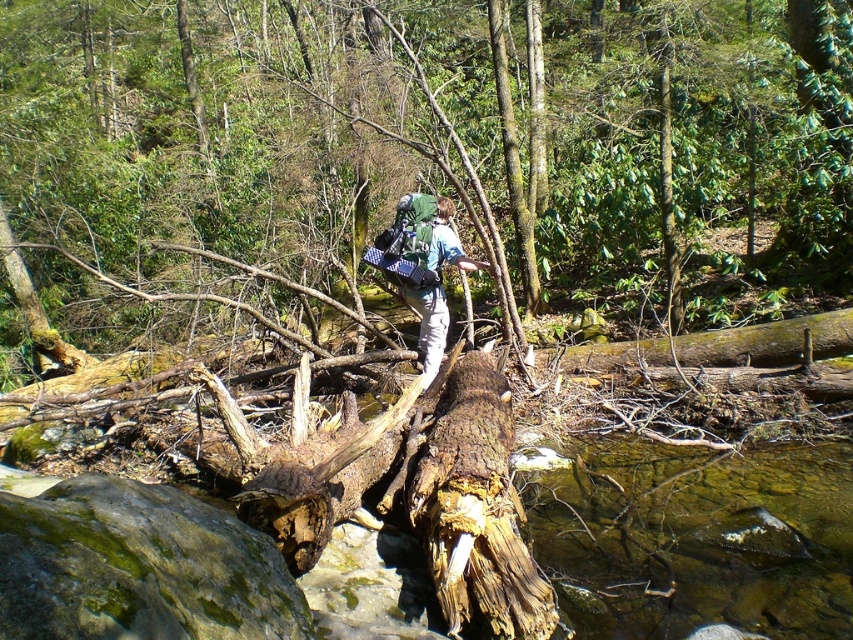
You are a hiker trying to cross the stream in the forest. You see a rough bark log at center and a rusty wood log at center. Which log is closer to you?

The rough bark log at center is 26.53 feet away from the rusty wood log at center, so the distance between them is 26.53 feet. However, without knowing your exact position, it is impossible to determine which is closer to you.

Consider the image. You are a hiker trying to cross the stream in the forest. There is a rusty wood log at center. Where is the point at (476, 509) located?

The point at (476, 509) is located on the rusty wood log at center.